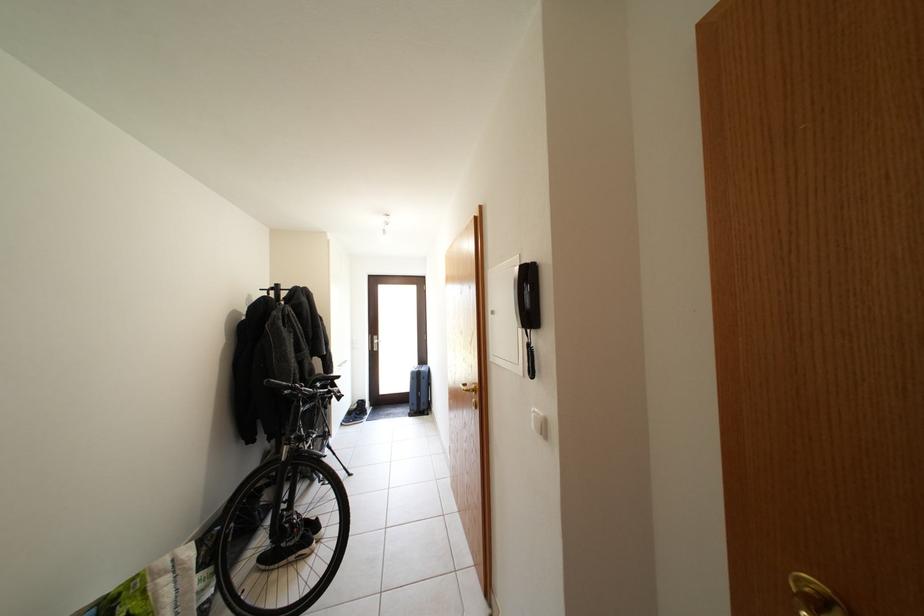
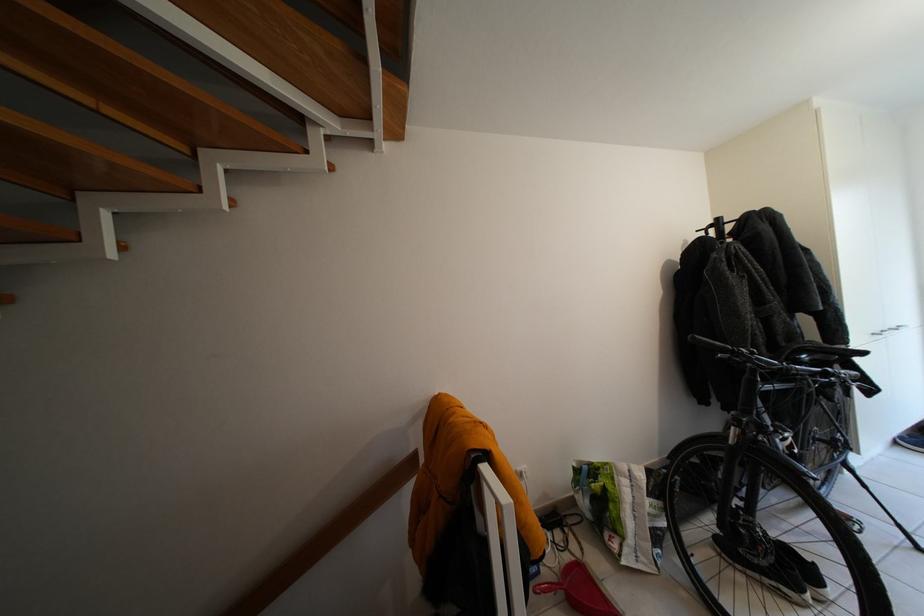
Question: The images are taken continuously from a first-person perspective. In which direction is your viewpoint rotating?

Choices:
 (A) Left
 (B) Right
 (C) Up
 (D) Down

Answer: (A)